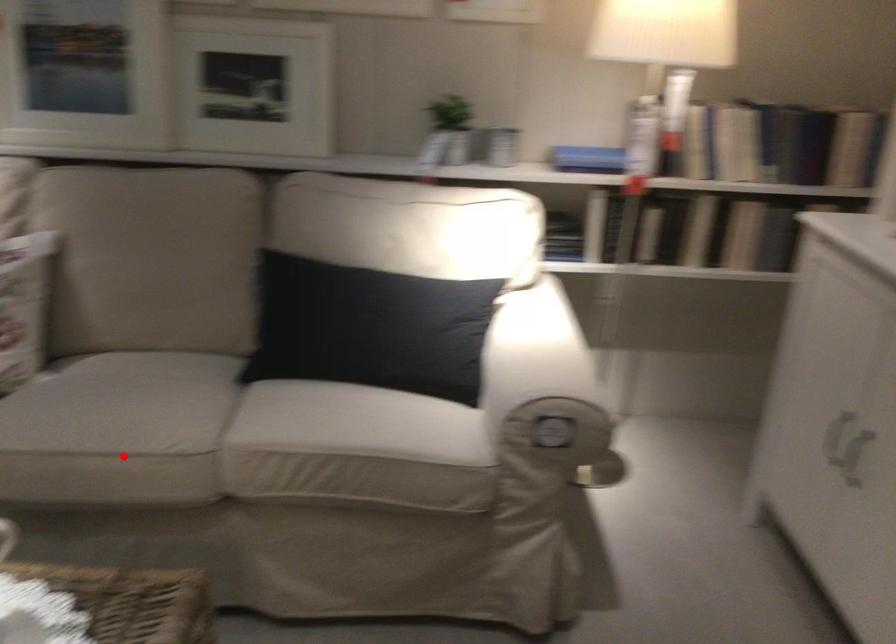
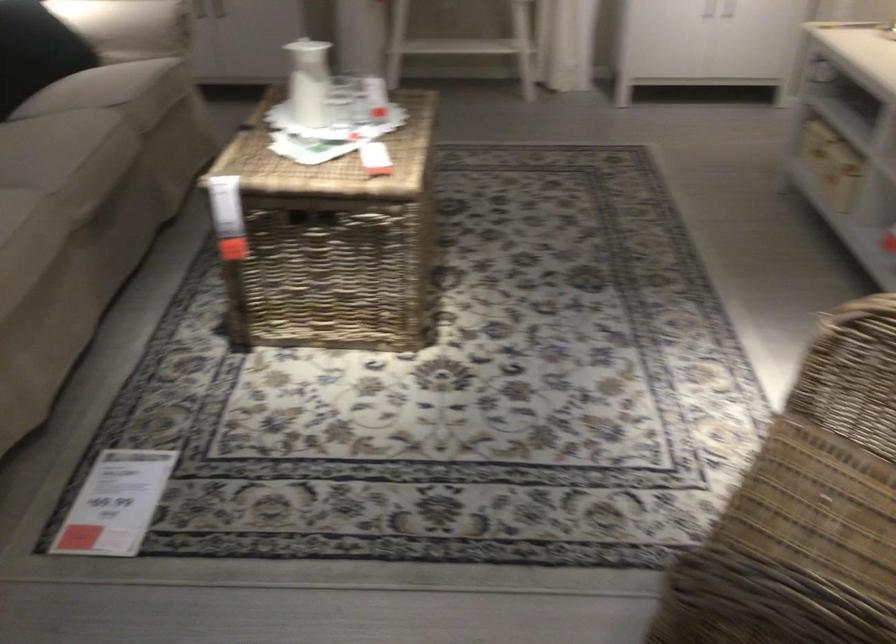
Where in the second image is the point corresponding to the highlighted location from the first image?

(109, 140)